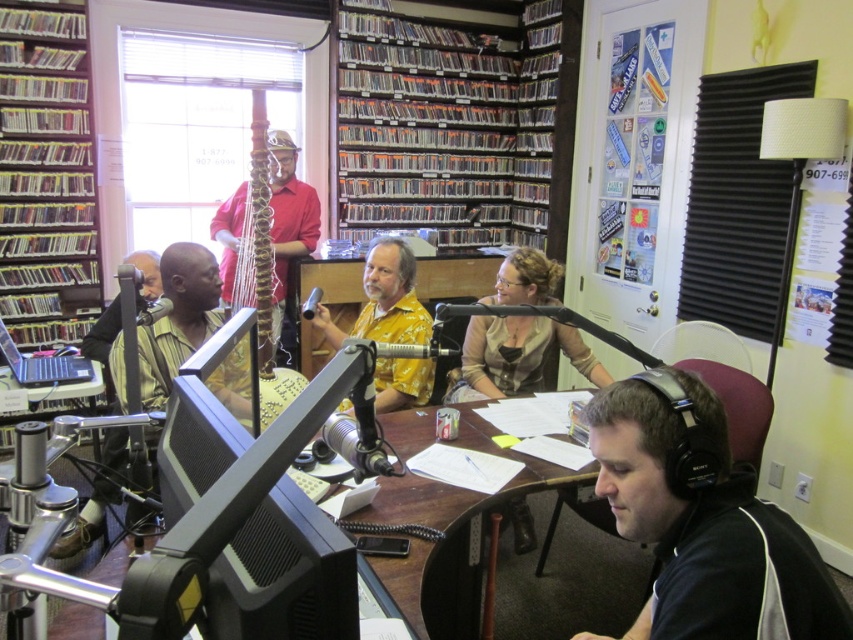
Question: Which object is closer to the camera taking this photo?

Choices:
 (A) yellowish cardboard bookshelf at left
 (B) metallic silver laptop at lower left
 (C) wooden harp at center

Answer: (A)

Question: Which object is positioned closest to the clear plastic cds at upper center?

Choices:
 (A) matte yellow shirt at center
 (B) matte black laptop at left

Answer: (A)

Question: Among these objects, which one is farthest from the camera?

Choices:
 (A) matte yellow shirt at center
 (B) metallic silver laptop at lower left
 (C) wooden harp at center
 (D) matte black laptop at left

Answer: (C)

Question: Observing the image, what is the correct spatial positioning of clear plastic cds at upper center in reference to yellowish cardboard bookshelf at left?

Choices:
 (A) left
 (B) right

Answer: (B)

Question: Observing the image, what is the correct spatial positioning of wooden harp at center in reference to matte black laptop at left?

Choices:
 (A) above
 (B) below

Answer: (A)

Question: Is the position of clear plastic cds at upper center more distant than that of wooden harp at center?

Choices:
 (A) yes
 (B) no

Answer: (A)